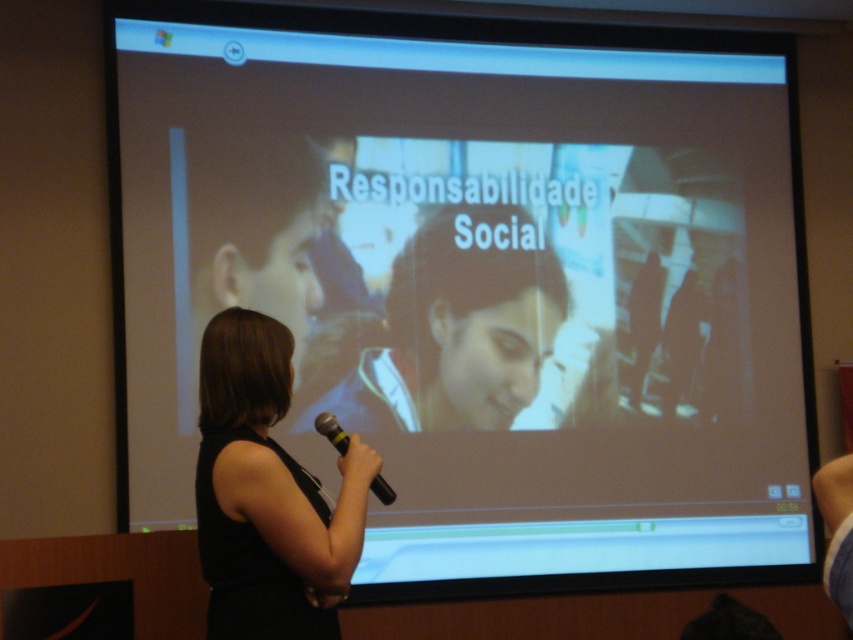
Question: Can you confirm if black fabric at center is bigger than yellow rubber microphone at center?

Choices:
 (A) no
 (B) yes

Answer: (B)

Question: Is black fabric at center wider than yellow rubber microphone at center?

Choices:
 (A) no
 (B) yes

Answer: (B)

Question: Among these objects, which one is nearest to the camera?

Choices:
 (A) yellow rubber microphone at center
 (B) black fabric at center

Answer: (B)

Question: Is black fabric at center to the left of yellow rubber microphone at center from the viewer's perspective?

Choices:
 (A) no
 (B) yes

Answer: (B)